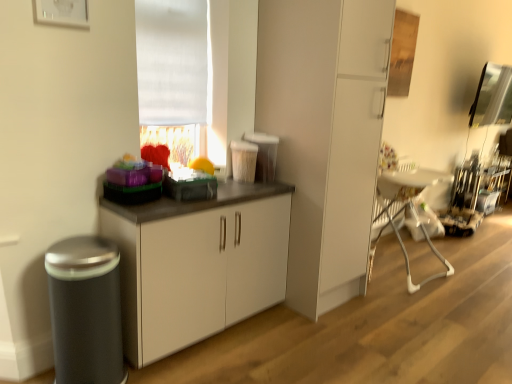
Question: Could you tell me if white plastic swivel chair at right is turned towards matte black toaster at center, arranged as the 2th appliance when viewed from the back?

Choices:
 (A) no
 (B) yes

Answer: (A)

Question: Is white plastic swivel chair at right facing away from matte black toaster at center, arranged as the 2th appliance when viewed from the back?

Choices:
 (A) no
 (B) yes

Answer: (A)

Question: Is white plastic swivel chair at right smaller than matte black toaster at center, arranged as the 2th appliance when viewed from the back?

Choices:
 (A) yes
 (B) no

Answer: (B)

Question: Can you confirm if white plastic swivel chair at right is bigger than matte black toaster at center, arranged as the 2th appliance when viewed from the back?

Choices:
 (A) yes
 (B) no

Answer: (A)

Question: Can you confirm if white plastic swivel chair at right is thinner than matte black toaster at center, which appears as the 2th appliance when viewed from the left?

Choices:
 (A) no
 (B) yes

Answer: (A)

Question: Is white plastic swivel chair at right further to the viewer compared to matte black toaster at center, which appears as the 2th appliance when viewed from the left?

Choices:
 (A) yes
 (B) no

Answer: (A)

Question: Considering the relative sizes of white matte cabinet at center, which appears as the second cabinetry when viewed from the left, and white plastic swivel chair at right in the image provided, is white matte cabinet at center, which appears as the second cabinetry when viewed from the left, smaller than white plastic swivel chair at right?

Choices:
 (A) no
 (B) yes

Answer: (A)

Question: Can you confirm if white matte cabinet at center, which appears as the second cabinetry when viewed from the left, is bigger than white plastic swivel chair at right?

Choices:
 (A) yes
 (B) no

Answer: (A)

Question: Can you confirm if white matte cabinet at center, which appears as the second cabinetry when viewed from the left, is shorter than white plastic swivel chair at right?

Choices:
 (A) yes
 (B) no

Answer: (B)

Question: From the image's perspective, is white matte cabinet at center, marked as the 1th cabinetry in a right-to-left arrangement, located beneath white plastic swivel chair at right?

Choices:
 (A) no
 (B) yes

Answer: (A)

Question: From a real-world perspective, is white matte cabinet at center, marked as the 1th cabinetry in a right-to-left arrangement, beneath white plastic swivel chair at right?

Choices:
 (A) no
 (B) yes

Answer: (A)

Question: From the image's perspective, is white matte cabinet at center, marked as the 1th cabinetry in a right-to-left arrangement, over white plastic swivel chair at right?

Choices:
 (A) yes
 (B) no

Answer: (A)

Question: Is metallic stainless steel coffee machine at right, which ranks as the third appliance in left-to-right order, a part of matte black toaster at center, which appears as the 2th appliance when viewed from the left?

Choices:
 (A) no
 (B) yes

Answer: (A)